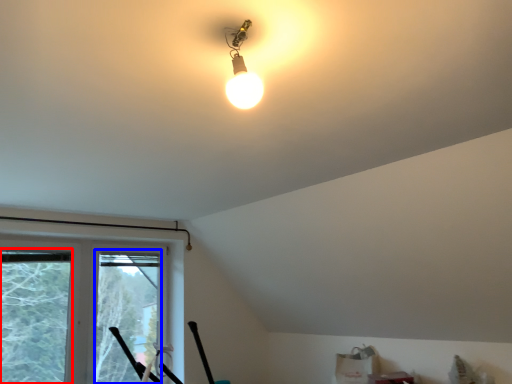
Question: Which of the following is the farthest to the observer, window screen (highlighted by a red box) or window screen (highlighted by a blue box)?

Choices:
 (A) window screen
 (B) window screen

Answer: (B)